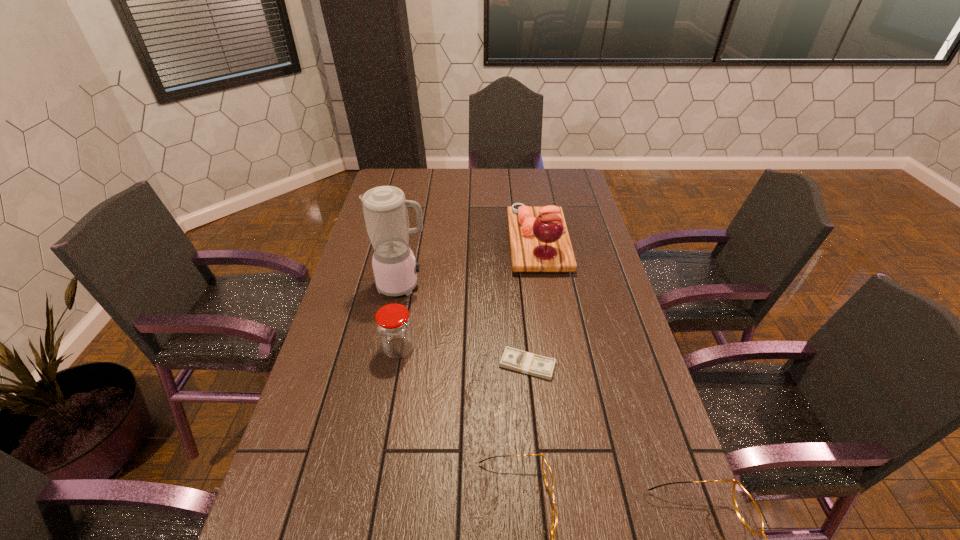
Locate an element on the screen. This screenshot has height=540, width=960. the tallest object is located at coordinates (385, 210).

I want to click on dollar, so click(x=514, y=359).

The image size is (960, 540). Identify the location of platter. (539, 241).

Find the location of a particular element. Image resolution: width=960 pixels, height=540 pixels. jar is located at coordinates (393, 324).

Image resolution: width=960 pixels, height=540 pixels. In order to click on vacant space situated 0.120m on the base of the food processor near the control knob in this screenshot , I will do `click(466, 285)`.

The image size is (960, 540). In order to click on free space located 0.050m on the front of the shortest object in this screenshot , I will do `click(531, 397)`.

You are a GUI agent. You are given a task and a screenshot of the screen. Output one action in this format:
    pyautogui.click(x=<x>, y=<y>)
    Task: Click on the vacant region located 0.380m on the back of the platter
    Image resolution: width=960 pixels, height=540 pixels.
    Given the screenshot: What is the action you would take?
    pyautogui.click(x=526, y=171)

The height and width of the screenshot is (540, 960). Find the location of `free spot located on the left of the fourth shortest object`. free spot located on the left of the fourth shortest object is located at coordinates (353, 348).

Where is `object that is at the left edge`? The image size is (960, 540). object that is at the left edge is located at coordinates (385, 210).

The image size is (960, 540). Identify the location of object positioned at the right edge. (539, 241).